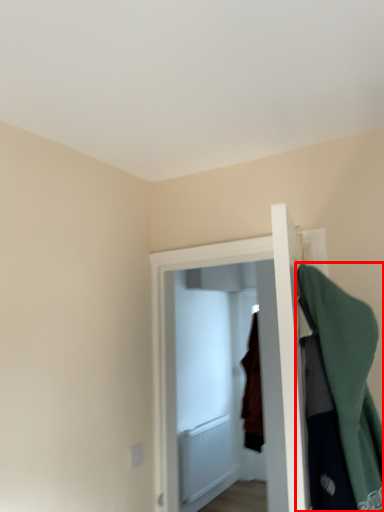
Question: From the image's perspective, where is cloak (annotated by the red box) located in relation to door in the image?

Choices:
 (A) above
 (B) below

Answer: (A)